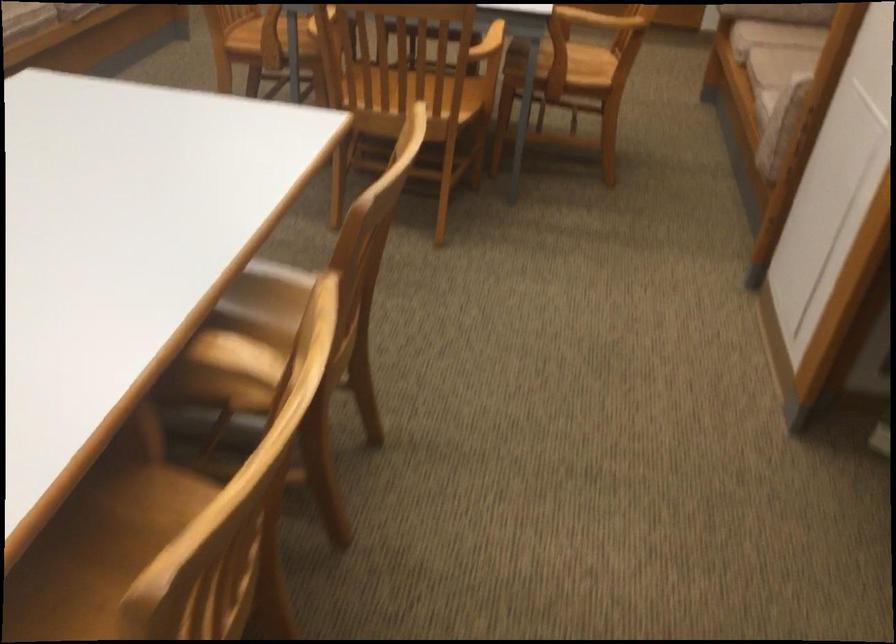
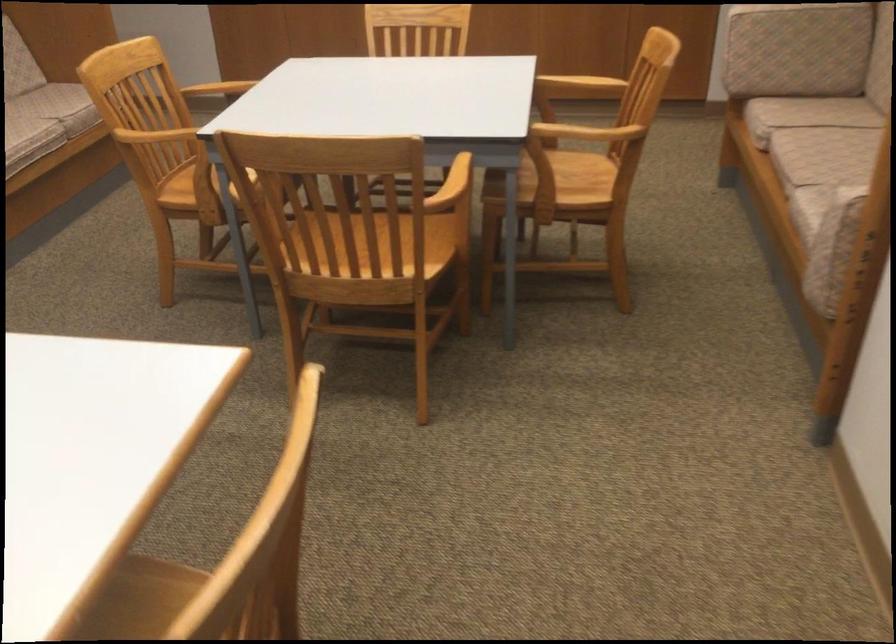
Question: I am providing you with two images of the same scene from different viewpoints. Which of the following objects are not visible in image2?

Choices:
 (A) wooden chair sitting surface
 (B) metal ladder
 (C) sofa armrest
 (D) sofa sitting surface

Answer: (A)